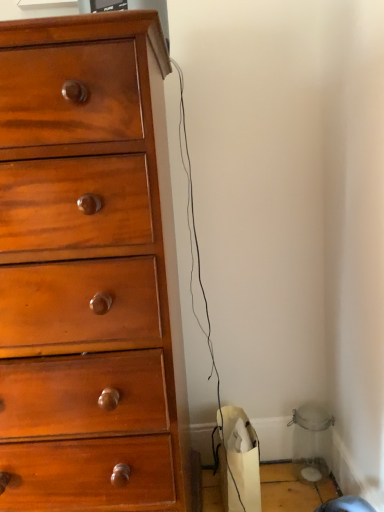
What is the approximate width of shiny wood chest of drawers at left?

It is 19.39 inches.

I want to click on shiny wood chest of drawers at left, so click(89, 271).

What do you see at coordinates (89, 271) in the screenshot? The width and height of the screenshot is (384, 512). I see `shiny wood chest of drawers at left` at bounding box center [89, 271].

Identify the location of shiny wood chest of drawers at left. (89, 271).